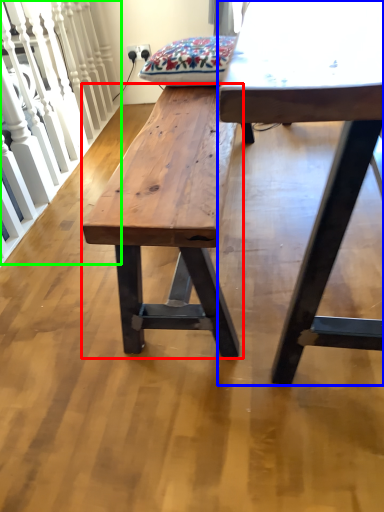
Question: Which object is positioned farthest from bench (highlighted by a red box)? Select from table (highlighted by a blue box) and rail (highlighted by a green box).

Choices:
 (A) table
 (B) rail

Answer: (B)